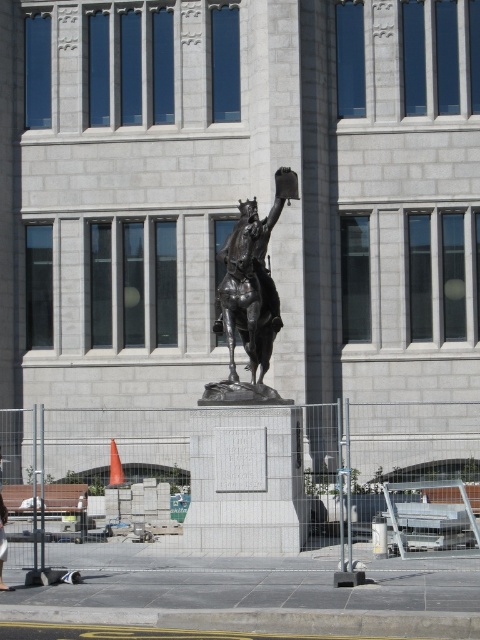
You are standing in front of the building and want to approach the bronze statue. You see the concrete fence at center at point [249,518]. Can you walk directly to the statue without crossing any obstacles?

The concrete fence at center is located at point [249,518], which is directly in front of the statue. Therefore, you would need to go around the fence to reach the statue.

You are standing in front of the bronze statue in front of the gray stone building. You need to reach a point that is exactly 143.84 feet away from your current position. Can you determine if the point at coordinates point [98,442] is the correct location to reach?

The point at coordinates point [98,442] is 143.84 feet from the viewer, so yes, it is the correct location to reach.

You are standing at the entrance of the gray stone building and want to take a photo of the bronze statue at center. Since the statue is fenced off, you need to stay behind the metal barriers. Based on the statue location coordinates, can you estimate if you can get a clear shot without any obstructions?

The bronze statue at center is located at point coordinates, so you can position yourself behind the metal barriers to ensure a clear shot without any obstructions as long as the barriers don